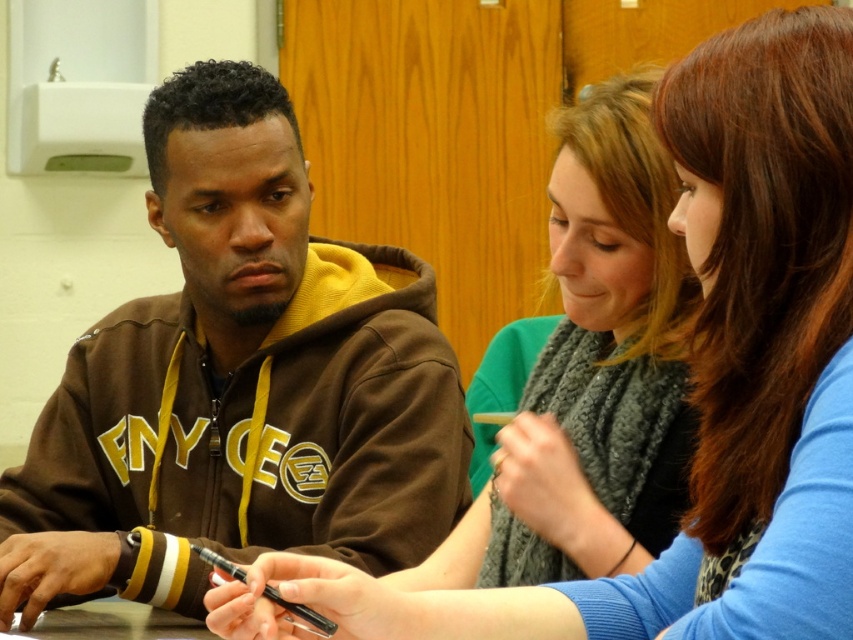
You are sitting at a table with two people. You need to pass a note to the person wearing the matte green sweater at center without letting the person in the brown fleece hoodie at left see it. How can you do this?

Since the brown fleece hoodie at left is closer to you than the matte green sweater at center, you can discreetly pass the note over the table behind the brown fleece hoodie at left to reach the matte green sweater at center without the person in the brown fleece hoodie at left noticing.

You are standing in front of the table where the three individuals are seated. There are two points marked on the table surface. The first point is at coordinate location (438, 380) and the second point is at coordinate location (698, 387). Which of these two points is closer to you?

Point (438, 380) is closer to you because it is further to the viewer than point (698, 387).

You are a photographer setting up a tripod to take a group photo of the brown fleece hoodie at left and the matte green sweater at center. The tripod has a height adjustment feature. To ensure both subjects are framed properly, which subject requires the tripod to be set at a higher position?

The brown fleece hoodie at left is taller than the matte green sweater at center, so the tripod should be set to a higher position to properly frame the taller subject.